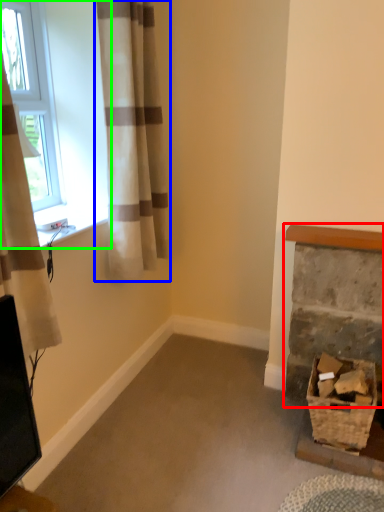
Question: Which object is the closest to the fireplace (highlighted by a red box)? Choose among these: curtain (highlighted by a blue box) or window (highlighted by a green box).

Choices:
 (A) curtain
 (B) window

Answer: (A)